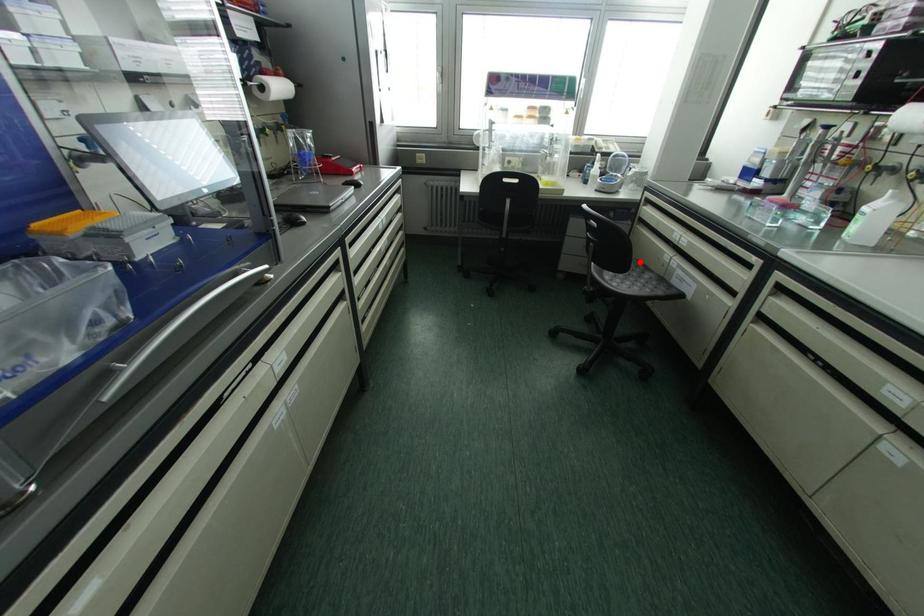
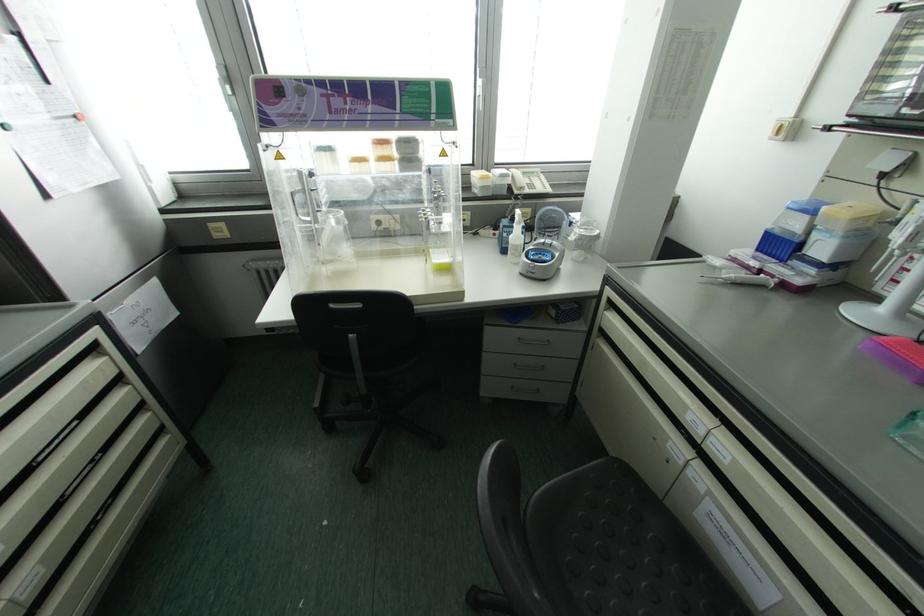
The point at the highlighted location is marked in the first image. Where is the corresponding point in the second image?

(626, 474)